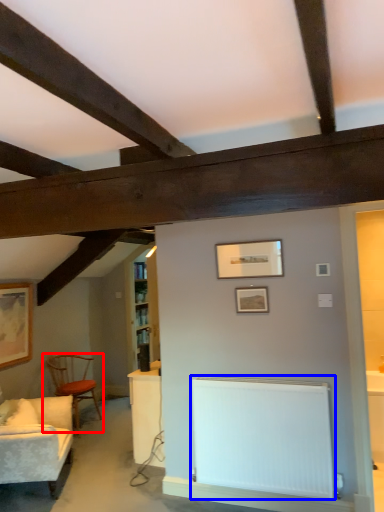
Question: Which object appears farthest to the camera in this image, chair (highlighted by a red box) or radiator (highlighted by a blue box)?

Choices:
 (A) chair
 (B) radiator

Answer: (A)